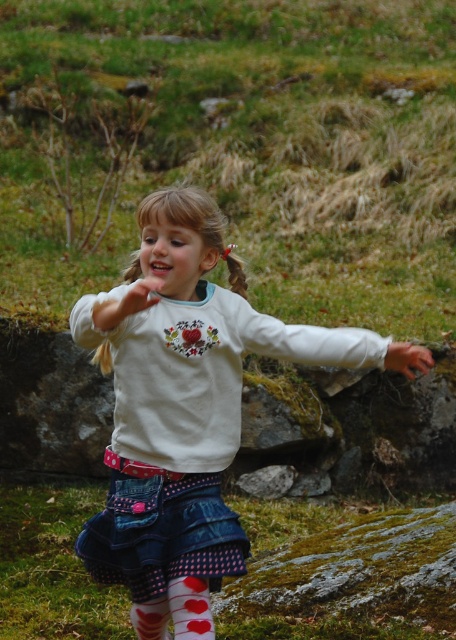
Does white cotton shirt at center appear on the left side of smooth skin hand at lower right?

Correct, you'll find white cotton shirt at center to the left of smooth skin hand at lower right.

At what (x,y) coordinates should I click in order to perform the action: click on white cotton shirt at center. Please return your answer as a coordinate pair (x, y). This screenshot has width=456, height=640. Looking at the image, I should click on (182, 396).

Which is in front, point (114, 406) or point (425, 356)?

Positioned in front is point (425, 356).

The width and height of the screenshot is (456, 640). Find the location of `white cotton shirt at center`. white cotton shirt at center is located at coordinates pyautogui.click(x=182, y=396).

Can you confirm if white matte socks at lower center is taller than smooth skin hand at lower right?

Yes, white matte socks at lower center is taller than smooth skin hand at lower right.

Which is more to the left, white matte socks at lower center or smooth skin hand at lower right?

white matte socks at lower center

Identify the location of white matte socks at lower center. The width and height of the screenshot is (456, 640). (190, 609).

Is the position of white cotton shirt at center more distant than that of white cotton sock at lower left?

No, white cotton shirt at center is closer to the viewer.

Who is higher up, white cotton shirt at center or white cotton sock at lower left?

Positioned higher is white cotton shirt at center.

Who is more distant from viewer, (291, 346) or (135, 628)?

The point (135, 628) is more distant.

Find the location of a particular element. Image resolution: width=456 pixels, height=640 pixels. white cotton shirt at center is located at coordinates (182, 396).